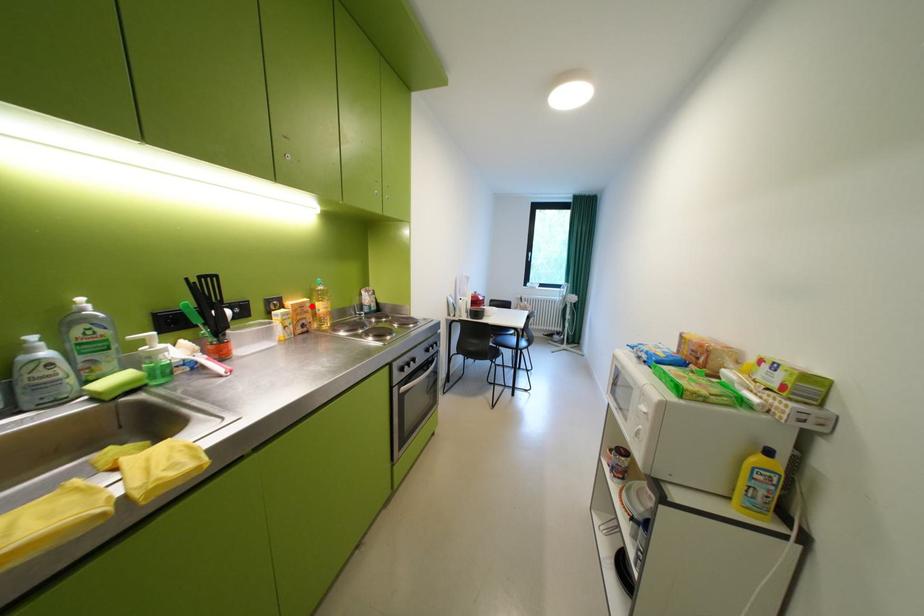
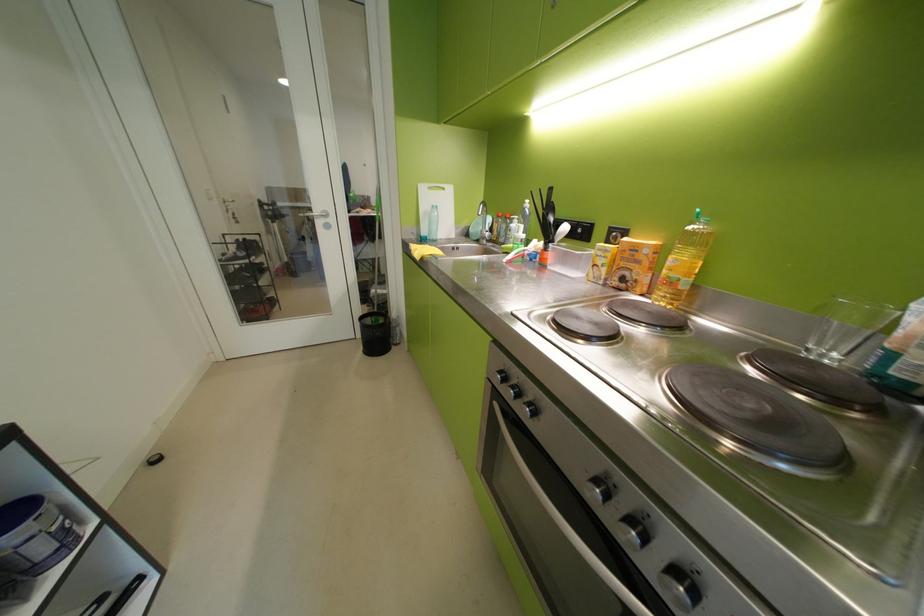
The point at the highlighted location is marked in the first image. Where is the corresponding point in the second image?

(646, 249)